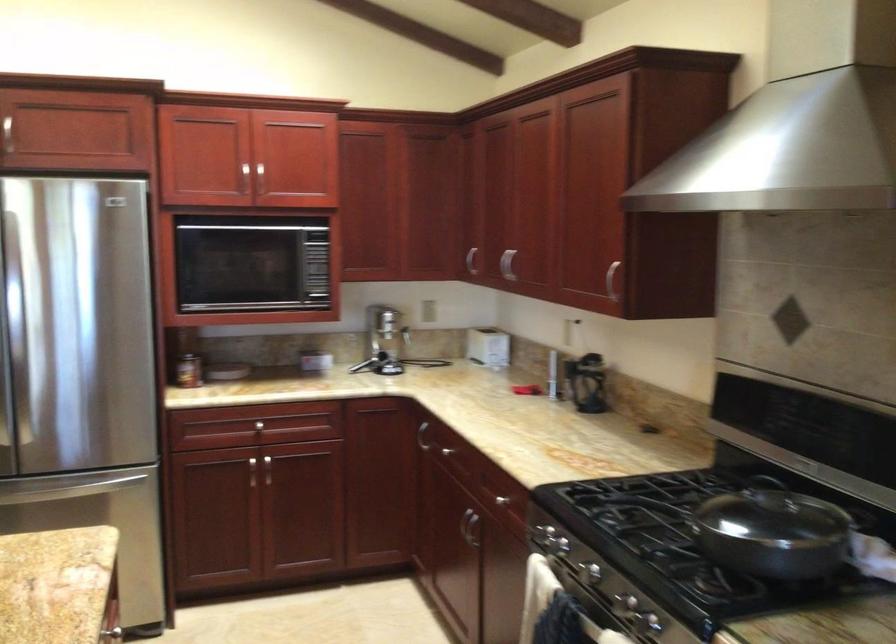
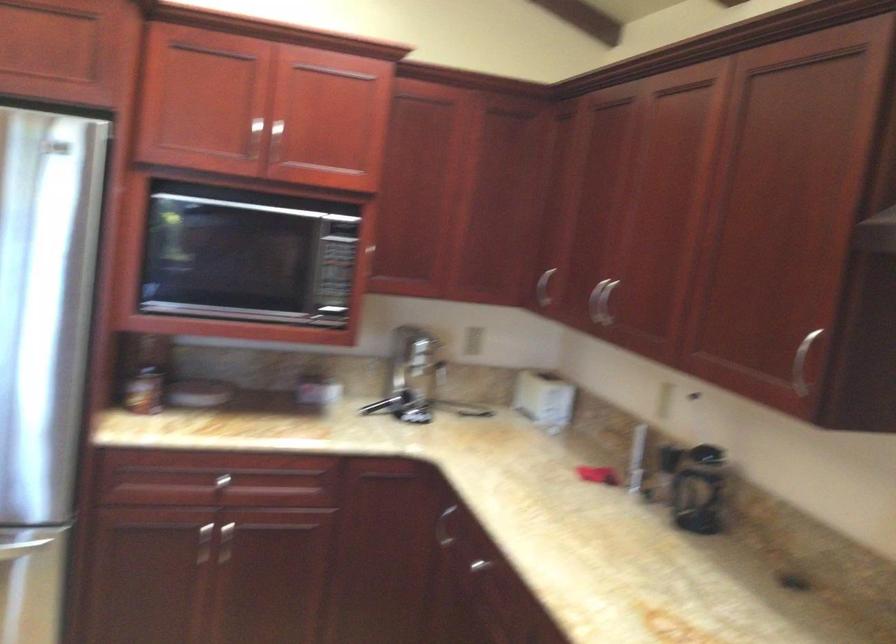
Locate, in the second image, the point that corresponds to point (506, 263) in the first image.

(600, 301)